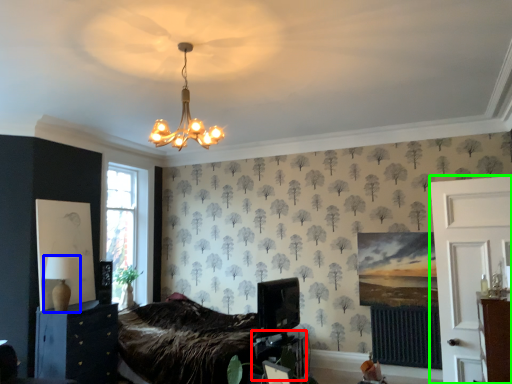
Question: Which is nearer to the table (highlighted by a red box)? table lamp (highlighted by a blue box) or side (highlighted by a green box).

Choices:
 (A) table lamp
 (B) side

Answer: (B)